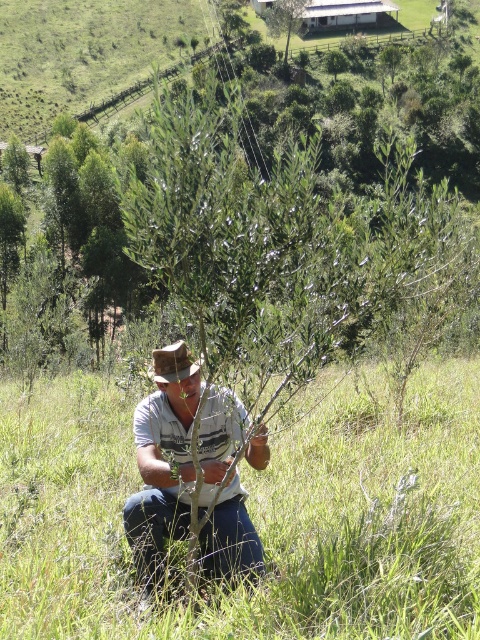
Is green grass at center above white cotton shirt at center?

Actually, green grass at center is below white cotton shirt at center.

Does green grass at center lie in front of white cotton shirt at center?

Yes, green grass at center is closer to the viewer.

Is point (109, 481) closer to viewer compared to point (162, 371)?

No, it is not.

In order to click on green grass at center in this screenshot , I will do `click(253, 516)`.

Does point (224, 444) come in front of point (272, 20)?

Yes, point (224, 444) is in front of point (272, 20).

Does point (149, 397) come farther from viewer compared to point (304, 6)?

That is False.

Who is more forward, (x=166, y=404) or (x=285, y=0)?

Positioned in front is point (x=166, y=404).

Find the location of `white cotton shirt at center`. white cotton shirt at center is located at coordinates (163, 460).

Who is more distant from viewer, (x=155, y=545) or (x=168, y=362)?

The point (x=168, y=362) is more distant.

Is point (218, 529) more distant than point (184, 362)?

That is True.

Locate an element on the screen. The height and width of the screenshot is (640, 480). white cotton shirt at center is located at coordinates (163, 460).